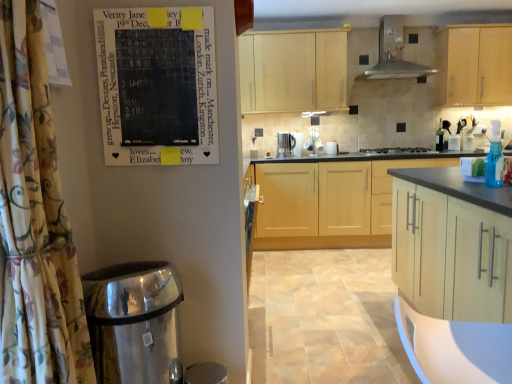
Question: From the image's perspective, is polished stainless steel water heater at lower left positioned above or below floral fabric shower curtain at left?

Choices:
 (A) below
 (B) above

Answer: (A)

Question: Is polished stainless steel water heater at lower left in front of or behind floral fabric shower curtain at left in the image?

Choices:
 (A) behind
 (B) front

Answer: (A)

Question: Estimate the real-world distances between objects in this image. Which object is closer to the floral fabric shower curtain at left?

Choices:
 (A) light wood cabinet at upper right, acting as the 3th cabinetry starting from the front
 (B) satin silver kettle at center, which is the second appliance from left to right
 (C) blue glass bottle at right
 (D) polished stainless steel water heater at lower left
 (E) metallic stainless steel range hood at upper center

Answer: (D)

Question: Which object is positioned closest to the light wood cabinet at upper right, which is the 2th cabinetry from back to front?

Choices:
 (A) metallic silver kettle at center, the 1th appliance viewed from the right
 (B) satin silver coffee maker at center
 (C) floral fabric shower curtain at left
 (D) polished stainless steel water heater at lower left
 (E) matte black poster at upper left

Answer: (A)